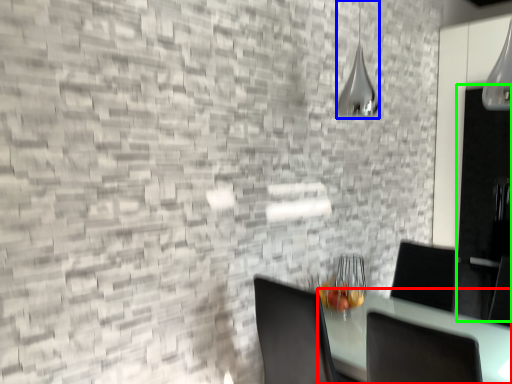
Question: Which object is positioned closest to table (highlighted by a red box)? Select from lamp (highlighted by a blue box) and glass door (highlighted by a green box).

Choices:
 (A) lamp
 (B) glass door

Answer: (B)